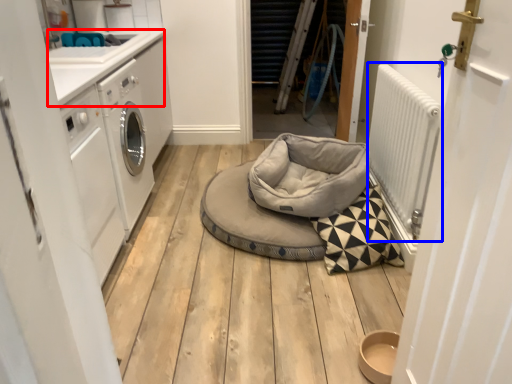
Question: Which object appears closest to the camera in this image, counter top (highlighted by a red box) or radiator (highlighted by a blue box)?

Choices:
 (A) counter top
 (B) radiator

Answer: (B)